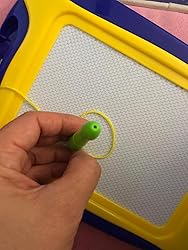
Locate an element on the screen. The width and height of the screenshot is (188, 250). sketch pad is located at coordinates pos(165,199).